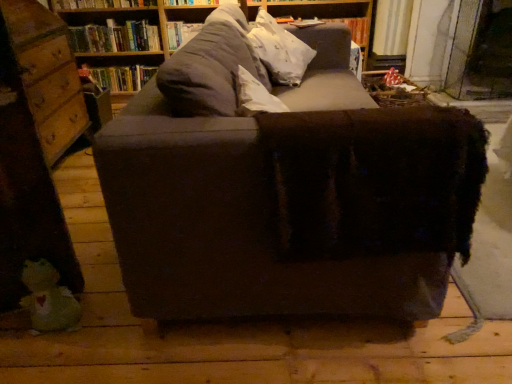
Question: Can you confirm if wooden drawer at left is positioned to the right of hardcover book at upper left, acting as the second book starting from the top?

Choices:
 (A) yes
 (B) no

Answer: (B)

Question: Is wooden drawer at left further to the viewer compared to hardcover book at upper left, acting as the second book starting from the top?

Choices:
 (A) yes
 (B) no

Answer: (B)

Question: Is wooden drawer at left facing away from hardcover book at upper left, acting as the second book starting from the top?

Choices:
 (A) yes
 (B) no

Answer: (B)

Question: Is wooden drawer at left taller than hardcover book at upper left, positioned as the first book in bottom-to-top order?

Choices:
 (A) no
 (B) yes

Answer: (B)

Question: From a real-world perspective, is wooden drawer at left below hardcover book at upper left, positioned as the first book in bottom-to-top order?

Choices:
 (A) yes
 (B) no

Answer: (B)

Question: Do you think dark brown fabric couch at center is within hardcover book at upper center, the second book from the bottom, or outside of it?

Choices:
 (A) outside
 (B) inside

Answer: (A)

Question: From the image's perspective, relative to hardcover book at upper center, acting as the first book starting from the top, is dark brown fabric couch at center above or below?

Choices:
 (A) above
 (B) below

Answer: (B)

Question: Based on their sizes in the image, would you say dark brown fabric couch at center is bigger or smaller than hardcover book at upper center, the second book from the bottom?

Choices:
 (A) big
 (B) small

Answer: (A)

Question: Is dark brown fabric couch at center wider or thinner than hardcover book at upper center, the second book from the bottom?

Choices:
 (A) wide
 (B) thin

Answer: (A)

Question: From a real-world perspective, is hardcover book at upper center, acting as the first book starting from the top, above or below hardcover book at upper left, acting as the second book starting from the top?

Choices:
 (A) below
 (B) above

Answer: (B)

Question: Visually, is hardcover book at upper center, the second book from the bottom, positioned to the left or to the right of hardcover book at upper left, positioned as the first book in bottom-to-top order?

Choices:
 (A) right
 (B) left

Answer: (A)

Question: Is hardcover book at upper center, the second book from the bottom, situated inside hardcover book at upper left, positioned as the first book in bottom-to-top order, or outside?

Choices:
 (A) outside
 (B) inside

Answer: (A)

Question: Considering the positions of hardcover book at upper center, the second book from the bottom, and hardcover book at upper left, positioned as the first book in bottom-to-top order, in the image, is hardcover book at upper center, the second book from the bottom, taller or shorter than hardcover book at upper left, positioned as the first book in bottom-to-top order,?

Choices:
 (A) tall
 (B) short

Answer: (A)

Question: Relative to wooden drawer at left, is hardcover book at upper center, acting as the first book starting from the top, in front or behind?

Choices:
 (A) behind
 (B) front

Answer: (A)

Question: From their relative heights in the image, would you say hardcover book at upper center, the second book from the bottom, is taller or shorter than wooden drawer at left?

Choices:
 (A) tall
 (B) short

Answer: (B)